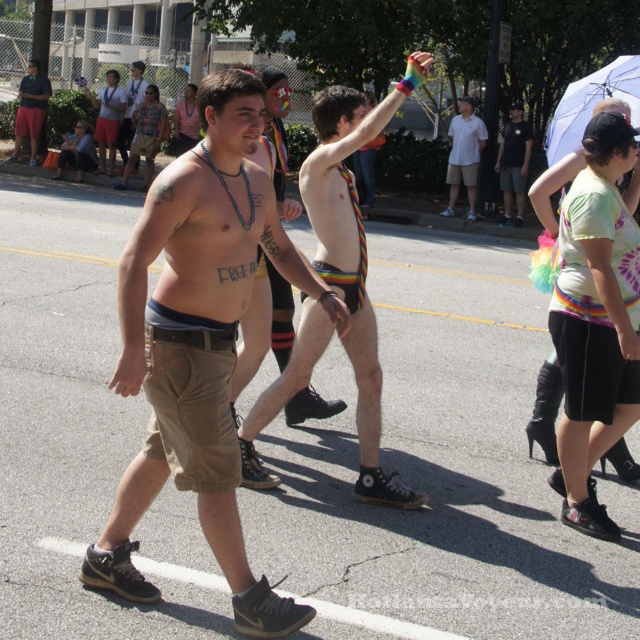
You are a photographer trying to capture both the white cotton shirt at center and the black cotton shirt at center in the same frame. Based on their sizes in the image, which shirt should you focus on to ensure both are visible without cropping?

The white cotton shirt at center is much taller than the black cotton shirt at center, so focusing on the white cotton shirt at center would allow the photographer to include both shirts in the frame since it occupies more vertical space.

Based on the photo, based on the scene description, can you determine the spatial relationship between the khaki shorts at center and the white cotton shirt at center?

The khaki shorts at center is located below the white cotton shirt at center.